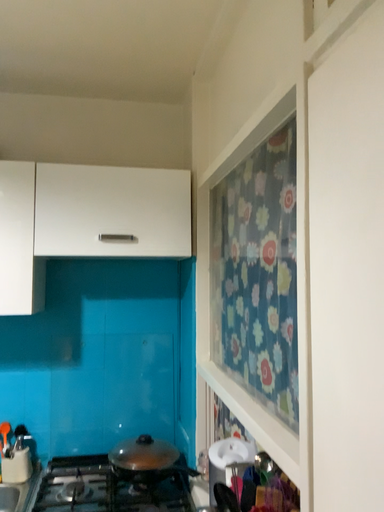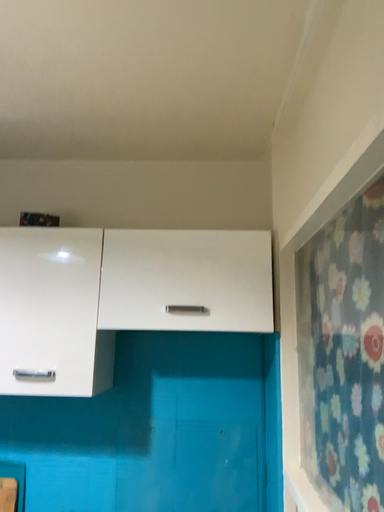
Question: How did the camera likely rotate when shooting the video?

Choices:
 (A) rotated downward
 (B) rotated upward

Answer: (B)